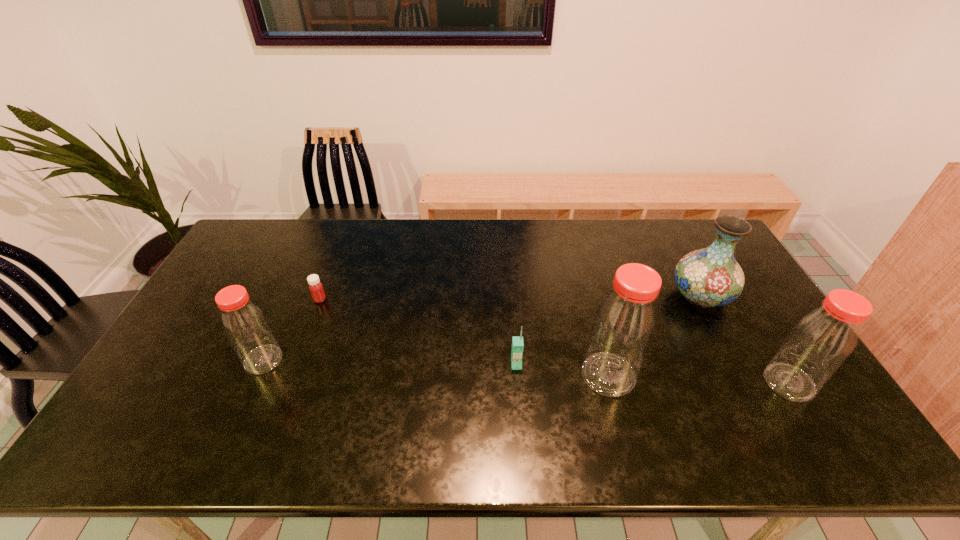
At what (x,y) coordinates should I click in order to perform the action: click on free region at the left edge. Please return your answer as a coordinate pair (x, y). The image size is (960, 540). Looking at the image, I should click on (243, 275).

At what (x,y) coordinates should I click in order to perform the action: click on free space at the far left corner of the desktop. Please return your answer as a coordinate pair (x, y). Image resolution: width=960 pixels, height=540 pixels. Looking at the image, I should click on (276, 254).

Locate an element on the screen. The width and height of the screenshot is (960, 540). vacant space at the near left corner of the desktop is located at coordinates (168, 407).

In the image, there is a desktop. Where is `vacant space at the near right corner`? This screenshot has width=960, height=540. vacant space at the near right corner is located at coordinates pos(760,389).

Where is `free point between the cellular telephone and the second shortest bottle`? The image size is (960, 540). free point between the cellular telephone and the second shortest bottle is located at coordinates (653, 373).

Locate an element on the screen. The width and height of the screenshot is (960, 540). free space between the vase and the rightmost bottle is located at coordinates (745, 339).

At what (x,y) coordinates should I click in order to perform the action: click on unoccupied position between the fifth tallest object and the shortest object. Please return your answer as a coordinate pair (x, y). This screenshot has width=960, height=540. Looking at the image, I should click on (418, 332).

Identify the location of unoccupied area between the leftmost object and the second tallest bottle. tap(526, 371).

Identify the location of vacant area between the fourth object from left to right and the leftmost object. This screenshot has width=960, height=540. (436, 367).

I want to click on unoccupied area between the fourth object from left to right and the medicine, so click(465, 337).